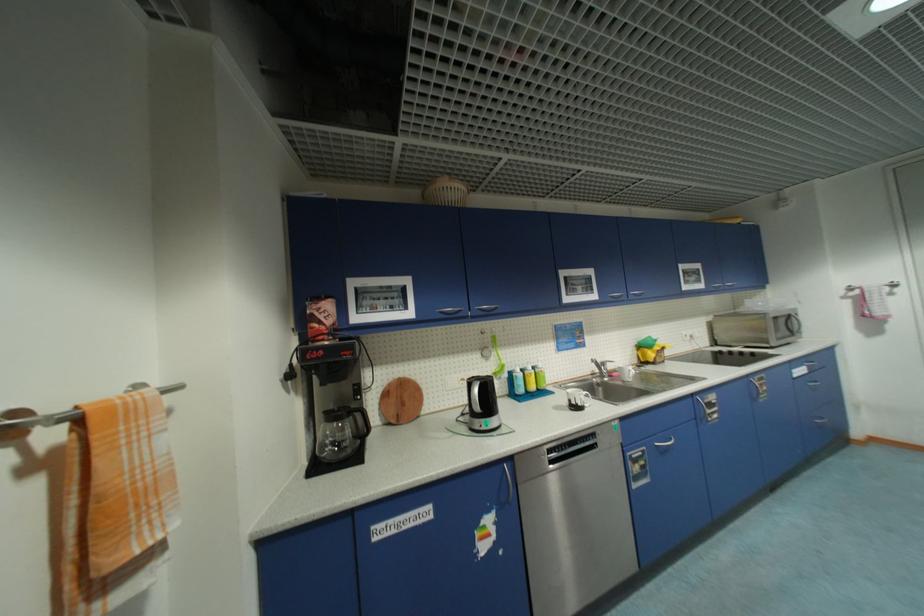
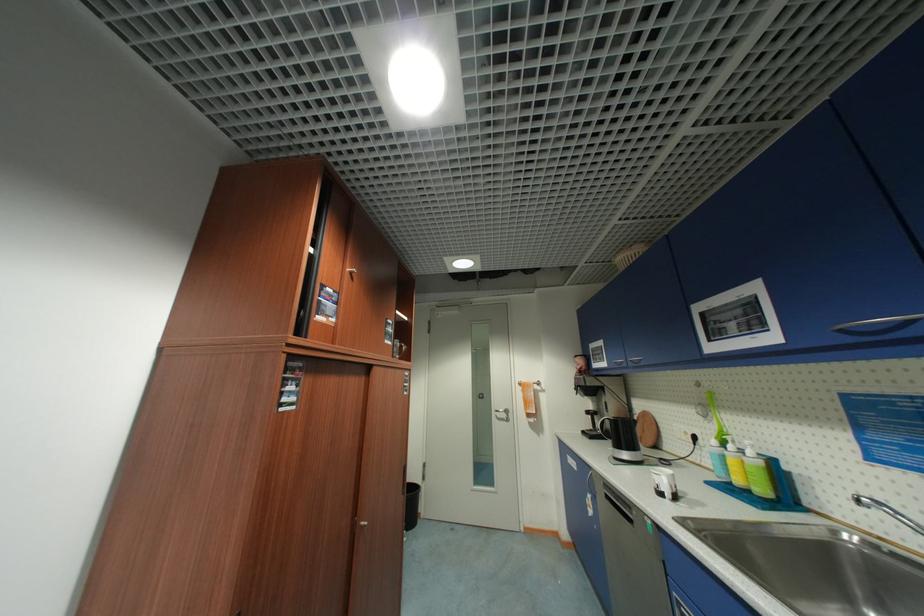
Find the pixel in the second image that matches (545,367) in the first image.

(756, 454)